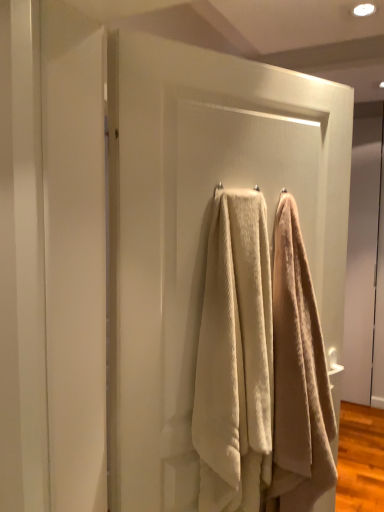
Question: Is beige textured towel at center, which is the 1th towel in right-to-left order, oriented towards beige textured towel at center, placed as the 2th towel when sorted from right to left?

Choices:
 (A) yes
 (B) no

Answer: (B)

Question: Can you confirm if beige textured towel at center, the 2th towel from the left, is shorter than beige textured towel at center, which ranks as the 1th towel in left-to-right order?

Choices:
 (A) yes
 (B) no

Answer: (B)

Question: Is the position of beige textured towel at center, the 2th towel from the left, more distant than that of beige textured towel at center, placed as the 2th towel when sorted from right to left?

Choices:
 (A) no
 (B) yes

Answer: (B)

Question: From the image's perspective, would you say beige textured towel at center, the 2th towel from the left, is shown under beige textured towel at center, placed as the 2th towel when sorted from right to left?

Choices:
 (A) yes
 (B) no

Answer: (A)

Question: Considering the relative positions of beige textured towel at center, the 2th towel from the left, and beige textured towel at center, placed as the 2th towel when sorted from right to left, in the image provided, is beige textured towel at center, the 2th towel from the left, to the left of beige textured towel at center, placed as the 2th towel when sorted from right to left, from the viewer's perspective?

Choices:
 (A) yes
 (B) no

Answer: (B)

Question: Relative to beige textured towel at center, the 2th towel from the left, is beige textured towel at center, which ranks as the 1th towel in left-to-right order, in front or behind?

Choices:
 (A) front
 (B) behind

Answer: (A)

Question: Based on their positions, is beige textured towel at center, which ranks as the 1th towel in left-to-right order, located to the left or right of beige textured towel at center, which is the 1th towel in right-to-left order?

Choices:
 (A) right
 (B) left

Answer: (B)

Question: From a real-world perspective, is beige textured towel at center, placed as the 2th towel when sorted from right to left, physically located above or below beige textured towel at center, the 2th towel from the left?

Choices:
 (A) below
 (B) above

Answer: (B)

Question: Is point (231, 483) closer or farther from the camera than point (281, 478)?

Choices:
 (A) closer
 (B) farther

Answer: (A)

Question: From the image's perspective, is white textured towel at center above or below beige textured towel at center, which ranks as the 1th towel in left-to-right order?

Choices:
 (A) below
 (B) above

Answer: (B)

Question: From their relative heights in the image, would you say white textured towel at center is taller or shorter than beige textured towel at center, which ranks as the 1th towel in left-to-right order?

Choices:
 (A) tall
 (B) short

Answer: (A)

Question: In the image, is white textured towel at center positioned in front of or behind beige textured towel at center, which ranks as the 1th towel in left-to-right order?

Choices:
 (A) front
 (B) behind

Answer: (A)

Question: Is white textured towel at center to the left or to the right of beige textured towel at center, which ranks as the 1th towel in left-to-right order, in the image?

Choices:
 (A) right
 (B) left

Answer: (A)

Question: From a real-world perspective, is white textured towel at center positioned above or below beige textured towel at center, the 2th towel from the left?

Choices:
 (A) above
 (B) below

Answer: (A)

Question: From their relative heights in the image, would you say white textured towel at center is taller or shorter than beige textured towel at center, the 2th towel from the left?

Choices:
 (A) tall
 (B) short

Answer: (A)